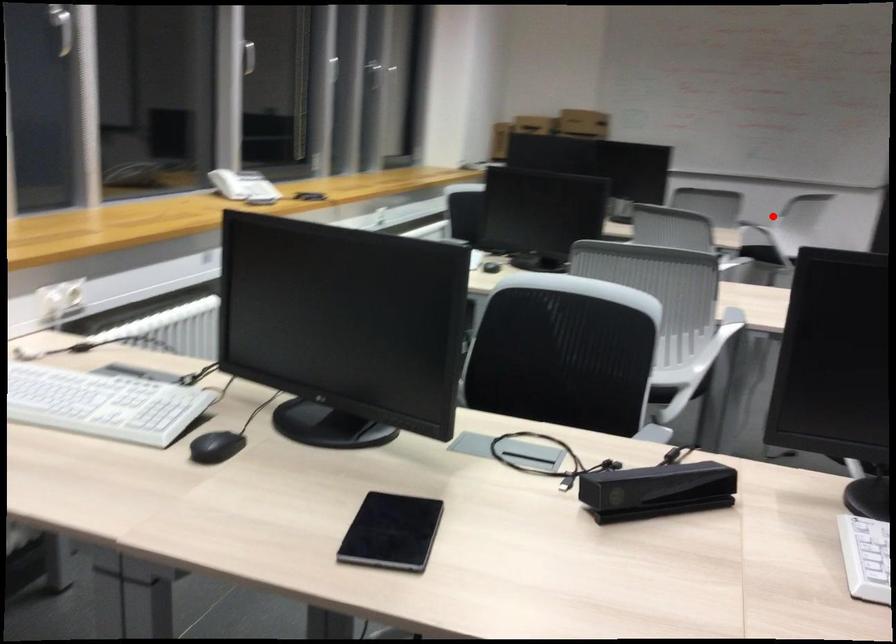
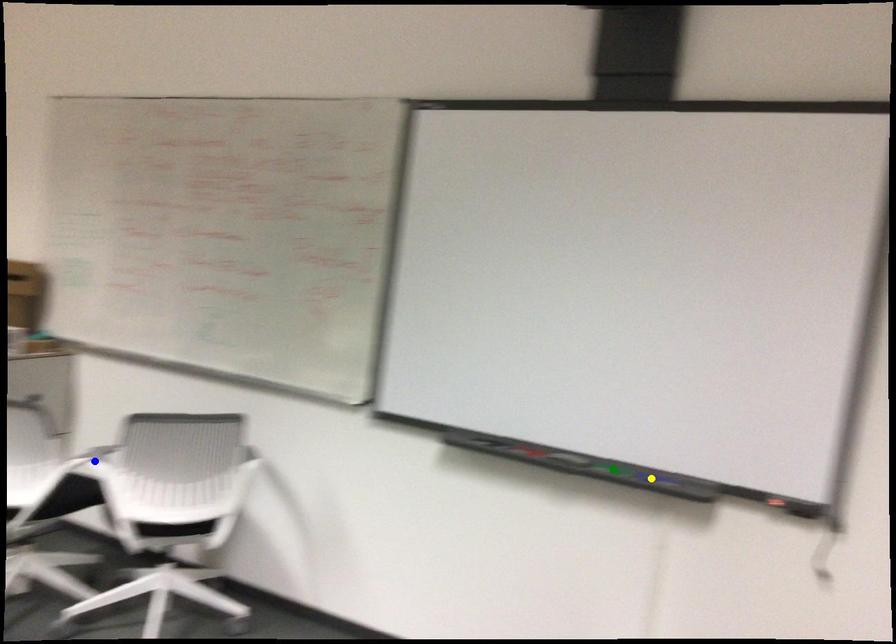
Question: I am providing you with two images of the same scene from different viewpoints. A red point is marked on the first image. You are given multiple points on the second image. Which spot in image 2 lines up with the point in image 1?

Choices:
 (A) yellow point
 (B) green point
 (C) blue point

Answer: (C)